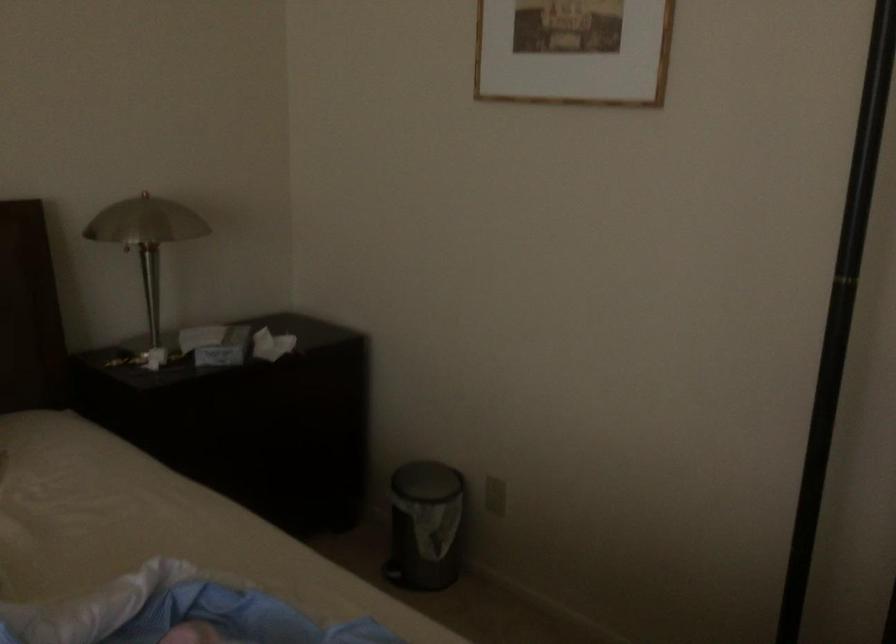
Describe the element at coordinates (151, 357) in the screenshot. I see `the lamp switch` at that location.